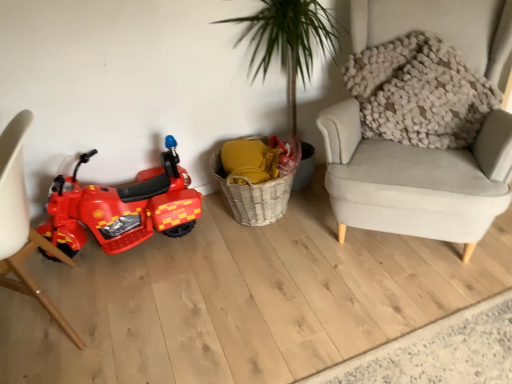
Locate an element on the screen. shiny plastic toy motorcycle at left is located at coordinates (122, 207).

What are the coordinates of `woven basket at center` in the screenshot? It's located at (254, 197).

Between matte white chair at left and shiny plastic toy motorcycle at left, which one has larger width?

With larger width is matte white chair at left.

Are matte white chair at left and shiny plastic toy motorcycle at left located far from each other?

No, matte white chair at left is in close proximity to shiny plastic toy motorcycle at left.

Considering the relative sizes of matte white chair at left and shiny plastic toy motorcycle at left in the image provided, is matte white chair at left shorter than shiny plastic toy motorcycle at left?

Incorrect, the height of matte white chair at left does not fall short of that of shiny plastic toy motorcycle at left.

Which of these two, matte white chair at left or woven basket at center, stands taller?

With more height is matte white chair at left.

Can you see matte white chair at left touching woven basket at center?

No.

Do you think matte white chair at left is within woven basket at center, or outside of it?

matte white chair at left is not enclosed by woven basket at center.

Relative to woven basket at center, is matte white chair at left in front or behind?

matte white chair at left is in front of woven basket at center.

Is shiny plastic toy motorcycle at left beside matte white chair at left?

No.

Could you tell me if shiny plastic toy motorcycle at left is turned towards matte white chair at left?

Yes, shiny plastic toy motorcycle at left faces towards matte white chair at left.

From the image's perspective, which is below, shiny plastic toy motorcycle at left or matte white chair at left?

matte white chair at left, from the image's perspective.

Considering the sizes of shiny plastic toy motorcycle at left and matte white chair at left in the image, is shiny plastic toy motorcycle at left bigger or smaller than matte white chair at left?

In the image, shiny plastic toy motorcycle at left appears to be smaller than matte white chair at left.

In the scene shown: Considering the sizes of woven basket at center and shiny plastic toy motorcycle at left in the image, is woven basket at center taller or shorter than shiny plastic toy motorcycle at left?

Clearly, woven basket at center is shorter compared to shiny plastic toy motorcycle at left.

Considering the points (253, 137) and (103, 243), which point is behind, point (253, 137) or point (103, 243)?

The point (253, 137) is more distant.

From the picture: Could you tell me if woven basket at center is turned towards shiny plastic toy motorcycle at left?

No, woven basket at center is not oriented towards shiny plastic toy motorcycle at left.

In the scene shown: Is woven basket at center oriented away from matte white chair at left?

No, woven basket at center is not facing away from matte white chair at left.

Measure the distance between woven basket at center and matte white chair at left.

They are 35.67 inches apart.

Is woven basket at center closer to the viewer compared to matte white chair at left?

No, the depth of woven basket at center is greater than that of matte white chair at left.

How many degrees apart are the facing directions of woven basket at center and matte white chair at left?

They differ by 90 degrees in their facing directions.

Which is in front, point (158, 185) or point (277, 201)?

Point (158, 185)

Would you consider shiny plastic toy motorcycle at left to be distant from woven basket at center?

Actually, shiny plastic toy motorcycle at left and woven basket at center are a little close together.

From the image's perspective, is shiny plastic toy motorcycle at left under woven basket at center?

Indeed, from the image's perspective, shiny plastic toy motorcycle at left is shown beneath woven basket at center.

I want to click on land vehicle below the matte white chair at left (from a real-world perspective), so click(x=122, y=207).

Find the location of a particular element. chair located on the left of woven basket at center is located at coordinates (22, 223).

Which object lies further to the anchor point woven basket at center, matte white chair at left or shiny plastic toy motorcycle at left?

The object further to woven basket at center is matte white chair at left.

Based on their spatial positions, is woven basket at center or shiny plastic toy motorcycle at left closer to matte white chair at left?

shiny plastic toy motorcycle at left lies closer to matte white chair at left than the other object.

Which object lies nearer to the anchor point woven basket at center, shiny plastic toy motorcycle at left or matte white chair at left?

Among the two, shiny plastic toy motorcycle at left is located nearer to woven basket at center.

When comparing their distances from matte white chair at left, does shiny plastic toy motorcycle at left or woven basket at center seem further?

Based on the image, woven basket at center appears to be further to matte white chair at left.

Considering their positions, is matte white chair at left positioned closer to shiny plastic toy motorcycle at left than woven basket at center?

matte white chair at left is positioned closer to the anchor shiny plastic toy motorcycle at left.

Looking at the image, which one is located closer to shiny plastic toy motorcycle at left, woven basket at center or matte white chair at left?

The object closer to shiny plastic toy motorcycle at left is matte white chair at left.

The width and height of the screenshot is (512, 384). Identify the location of land vehicle situated between matte white chair at left and woven basket at center from left to right. (122, 207).